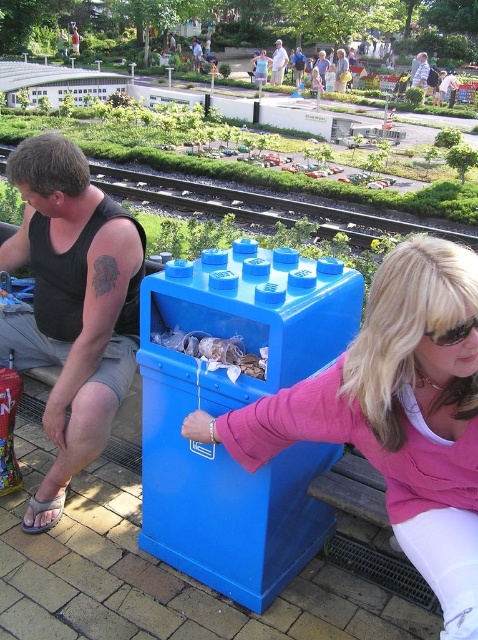
Does pink matte sweater at center have a lesser width compared to blue plastic trash can at center?

Incorrect, pink matte sweater at center's width is not less than blue plastic trash can at center's.

Does point (470, 621) come farther from viewer compared to point (171, 340)?

No, (470, 621) is closer to viewer.

Image resolution: width=478 pixels, height=640 pixels. In order to click on pink matte sweater at center in this screenshot , I will do `click(394, 416)`.

Does pink matte sweater at center appear on the right side of sunglasses at center?

In fact, pink matte sweater at center is to the left of sunglasses at center.

Which is behind, point (445, 621) or point (468, 330)?

Positioned behind is point (445, 621).

I want to click on pink matte sweater at center, so click(394, 416).

Between black tank top at left and sunglasses at center, which one is positioned higher?

Positioned higher is black tank top at left.

The image size is (478, 640). Describe the element at coordinates (73, 298) in the screenshot. I see `black tank top at left` at that location.

At what (x,y) coordinates should I click in order to perform the action: click on black tank top at left. Please return your answer as a coordinate pair (x, y). The image size is (478, 640). Looking at the image, I should click on (73, 298).